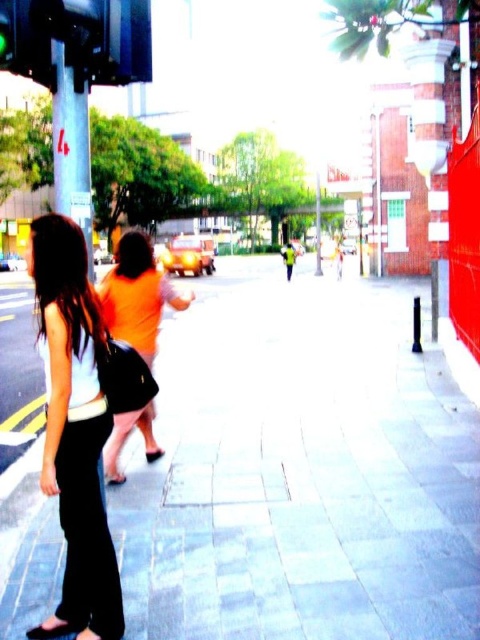
Is point (304, 522) more distant than point (170, 305)?

No.

Between gray concrete pavement at center and orange fabric shirt at center, which one has more height?

Standing taller between the two is orange fabric shirt at center.

Find the location of a particular element. This screenshot has width=480, height=640. gray concrete pavement at center is located at coordinates (301, 468).

Is gray concrete pavement at center taller than matte black pants at left?

Yes.

Between point (325, 628) and point (72, 385), which one is positioned behind?

Point (325, 628)

Between point (260, 525) and point (56, 397), which one is positioned in front?

Point (56, 397) is in front.

Locate an element on the screen. This screenshot has height=640, width=480. gray concrete pavement at center is located at coordinates (301, 468).

Does point (83, 365) lie in front of point (112, 330)?

Yes, point (83, 365) is closer to viewer.

Is point (93, 611) farther from camera compared to point (159, 292)?

That is False.

The image size is (480, 640). Find the location of `matte black pants at left`. matte black pants at left is located at coordinates (74, 429).